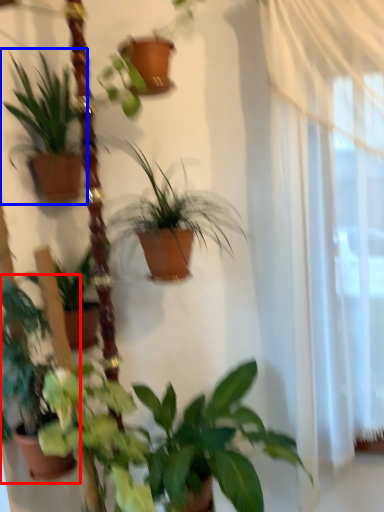
Question: Which of the following is the closest to the observer, houseplant (highlighted by a red box) or houseplant (highlighted by a blue box)?

Choices:
 (A) houseplant
 (B) houseplant

Answer: (A)